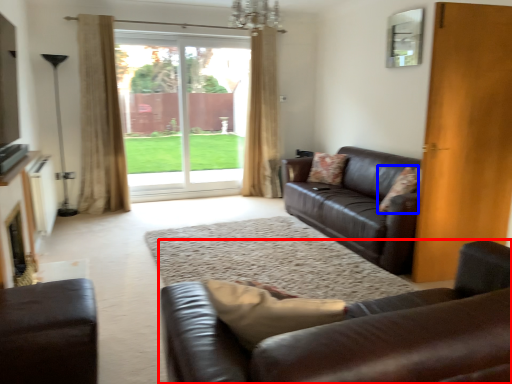
Question: Among these objects, which one is farthest to the camera, studio couch (highlighted by a red box) or pillow (highlighted by a blue box)?

Choices:
 (A) studio couch
 (B) pillow

Answer: (B)